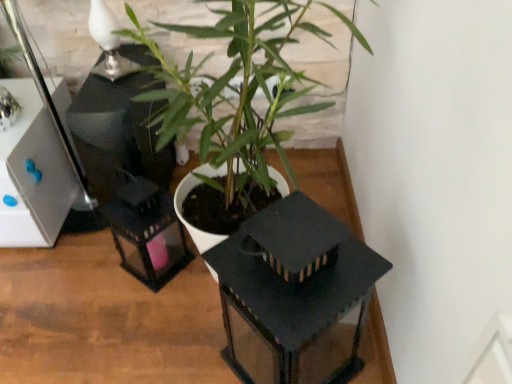
Question: Is matte black lantern at center placed right next to white glossy table lamp at upper left?

Choices:
 (A) yes
 (B) no

Answer: (B)

Question: Is matte black lantern at center positioned behind white glossy table lamp at upper left?

Choices:
 (A) yes
 (B) no

Answer: (B)

Question: From a real-world perspective, does matte black lantern at center sit lower than white glossy table lamp at upper left?

Choices:
 (A) no
 (B) yes

Answer: (B)

Question: Is matte black lantern at center aimed at white glossy table lamp at upper left?

Choices:
 (A) yes
 (B) no

Answer: (B)

Question: From the image's perspective, is matte black lantern at center beneath white glossy table lamp at upper left?

Choices:
 (A) no
 (B) yes

Answer: (B)

Question: Considering the positions of white glossy table lamp at upper left and green matte plant at center in the image, is white glossy table lamp at upper left taller or shorter than green matte plant at center?

Choices:
 (A) short
 (B) tall

Answer: (A)

Question: Is white glossy table lamp at upper left bigger or smaller than green matte plant at center?

Choices:
 (A) big
 (B) small

Answer: (B)

Question: Is white glossy table lamp at upper left in front of or behind green matte plant at center in the image?

Choices:
 (A) behind
 (B) front

Answer: (A)

Question: Based on their positions, is white glossy table lamp at upper left located to the left or right of green matte plant at center?

Choices:
 (A) right
 (B) left

Answer: (B)

Question: Is white glossy table lamp at upper left bigger or smaller than matte black lantern at center?

Choices:
 (A) small
 (B) big

Answer: (A)

Question: Is white glossy table lamp at upper left situated inside matte black lantern at center or outside?

Choices:
 (A) inside
 (B) outside

Answer: (B)

Question: From the image's perspective, is white glossy table lamp at upper left located above or below matte black lantern at center?

Choices:
 (A) below
 (B) above

Answer: (B)

Question: Would you say white glossy table lamp at upper left is to the left or to the right of matte black lantern at center in the picture?

Choices:
 (A) left
 (B) right

Answer: (A)

Question: Is point (138, 342) positioned closer to the camera than point (245, 29)?

Choices:
 (A) farther
 (B) closer

Answer: (A)

Question: Is matte black lantern at center in front of or behind green matte plant at center in the image?

Choices:
 (A) front
 (B) behind

Answer: (B)